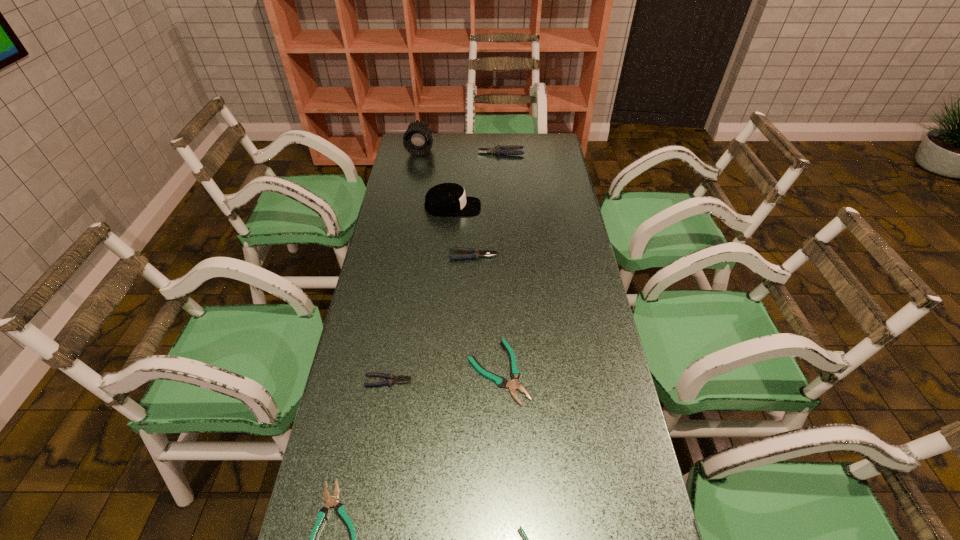
Identify the location of teal pliers that is the second closest to the telephoto lens. (331, 501).

Where is `teal pliers that is the second closest to the second shortest pliers`? teal pliers that is the second closest to the second shortest pliers is located at coordinates (513, 385).

Locate an element on the screen. free region that satisfies the following two spatial constraints: 1. on the back side of the farthest teal pliers; 2. on the front-facing side of the seventh shortest object is located at coordinates (492, 207).

The width and height of the screenshot is (960, 540). In order to click on vacant area in the image that satisfies the following two spatial constraints: 1. on the front-facing side of the fourth tallest pliers; 2. on the right side of the sixth nearest object in this screenshot , I will do `click(441, 372)`.

Where is `blank space that satisfies the following two spatial constraints: 1. on the back side of the fourth tallest pliers; 2. on the front-facing side of the second tallest object`? blank space that satisfies the following two spatial constraints: 1. on the back side of the fourth tallest pliers; 2. on the front-facing side of the second tallest object is located at coordinates (492, 207).